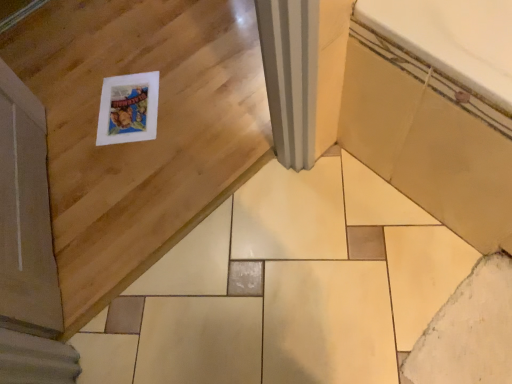
Where is `vacant area situated below white matte ceramic tile at lower right (from a real-world perspective)`? The height and width of the screenshot is (384, 512). vacant area situated below white matte ceramic tile at lower right (from a real-world perspective) is located at coordinates tap(472, 337).